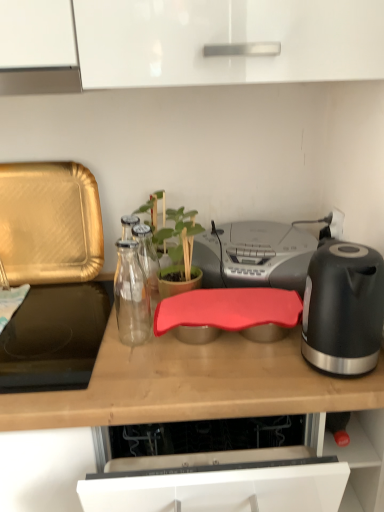
Where is `blank space situated above black matte electric kettle at right (from a real-world perspective)`? The height and width of the screenshot is (512, 384). blank space situated above black matte electric kettle at right (from a real-world perspective) is located at coordinates (350, 253).